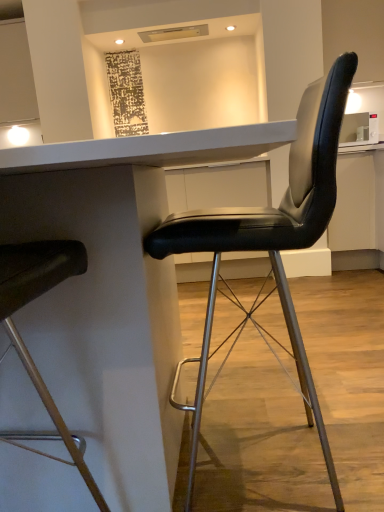
What is the approximate width of matte black chair at left, which appears as the 2th chair when viewed from the right?

16.75 inches.

You are a GUI agent. You are given a task and a screenshot of the screen. Output one action in this format:
    pyautogui.click(x=<x>, y=<y>)
    Task: Click on the white glossy table at center
    
    Given the screenshot: What is the action you would take?
    pyautogui.click(x=114, y=293)

Relative to black leather chair at right, acting as the 2th chair starting from the left, is matte black chair at left, which appears as the 2th chair when viewed from the right, in front or behind?

Visually, matte black chair at left, which appears as the 2th chair when viewed from the right, is located in front of black leather chair at right, acting as the 2th chair starting from the left.

Could you tell me if matte black chair at left, the 1th chair in the left-to-right sequence, is facing black leather chair at right, acting as the 2th chair starting from the left?

No, matte black chair at left, the 1th chair in the left-to-right sequence, is not oriented towards black leather chair at right, acting as the 2th chair starting from the left.

From a real-world perspective, who is located lower, matte black chair at left, the 1th chair in the left-to-right sequence, or black leather chair at right, acting as the 2th chair starting from the left?

black leather chair at right, acting as the 2th chair starting from the left.

Is point (5, 262) farther from viewer compared to point (159, 259)?

No.

Between point (318, 100) and point (24, 364), which one is positioned in front?

Positioned in front is point (24, 364).

Is black leather chair at right, the first chair in the right-to-left sequence, inside the boundaries of matte black chair at left, which appears as the 2th chair when viewed from the right, or outside?

black leather chair at right, the first chair in the right-to-left sequence, is outside matte black chair at left, which appears as the 2th chair when viewed from the right.

Find the location of a particular element. chair on the right of matte black chair at left, the 1th chair in the left-to-right sequence is located at coordinates (274, 234).

Consider the image. Can you tell me how much black leather chair at right, the first chair in the right-to-left sequence, and matte black chair at left, the 1th chair in the left-to-right sequence, differ in facing direction?

90.8 degrees separate the facing orientations of black leather chair at right, the first chair in the right-to-left sequence, and matte black chair at left, the 1th chair in the left-to-right sequence.

Considering the sizes of objects white glossy table at center and matte black chair at left, which appears as the 2th chair when viewed from the right, in the image provided, who is bigger, white glossy table at center or matte black chair at left, which appears as the 2th chair when viewed from the right,?

white glossy table at center is bigger.

Is white glossy table at center in front of matte black chair at left, which appears as the 2th chair when viewed from the right?

No.

Considering the points (17, 293) and (293, 130), which point is behind, point (17, 293) or point (293, 130)?

The point (17, 293) is farther.

Who is taller, matte black chair at left, which appears as the 2th chair when viewed from the right, or white glossy table at center?

matte black chair at left, which appears as the 2th chair when viewed from the right, is taller.

Is matte black chair at left, the 1th chair in the left-to-right sequence, to the left of white glossy table at center from the viewer's perspective?

Indeed, matte black chair at left, the 1th chair in the left-to-right sequence, is positioned on the left side of white glossy table at center.

Consider the image. From a real-world perspective, relative to white glossy table at center, is matte black chair at left, which appears as the 2th chair when viewed from the right, vertically above or below?

matte black chair at left, which appears as the 2th chair when viewed from the right, is above white glossy table at center.

Which is behind, point (159, 257) or point (237, 155)?

The point (237, 155) is farther from the camera.

In the image, is black leather chair at right, acting as the 2th chair starting from the left, on the left side or the right side of white glossy table at center?

black leather chair at right, acting as the 2th chair starting from the left, is positioned on white glossy table at center's right side.

Is white glossy table at center surrounded by black leather chair at right, the first chair in the right-to-left sequence?

No.

Is the position of black leather chair at right, acting as the 2th chair starting from the left, less distant than that of white glossy table at center?

No, it is behind white glossy table at center.

Who is bigger, white glossy table at center or black leather chair at right, the first chair in the right-to-left sequence?

With larger size is white glossy table at center.

Between white glossy table at center and black leather chair at right, the first chair in the right-to-left sequence, which one has less height?

white glossy table at center is shorter.

How much distance is there between white glossy table at center and black leather chair at right, acting as the 2th chair starting from the left?

white glossy table at center is 8.12 inches from black leather chair at right, acting as the 2th chair starting from the left.

Considering the relative positions of white glossy table at center and black leather chair at right, the first chair in the right-to-left sequence, in the image provided, is white glossy table at center in front of black leather chair at right, the first chair in the right-to-left sequence,?

That is True.

The width and height of the screenshot is (384, 512). I want to click on chair behind the matte black chair at left, the 1th chair in the left-to-right sequence, so click(x=274, y=234).

The image size is (384, 512). In order to click on chair below the black leather chair at right, the first chair in the right-to-left sequence (from the image's perspective) in this screenshot , I will do `click(32, 300)`.

Which object lies further to the anchor point matte black chair at left, the 1th chair in the left-to-right sequence, black leather chair at right, the first chair in the right-to-left sequence, or white glossy table at center?

black leather chair at right, the first chair in the right-to-left sequence, is positioned further to the anchor matte black chair at left, the 1th chair in the left-to-right sequence.

Considering their positions, is white glossy table at center positioned closer to matte black chair at left, which appears as the 2th chair when viewed from the right, than black leather chair at right, acting as the 2th chair starting from the left?

white glossy table at center is closer to matte black chair at left, which appears as the 2th chair when viewed from the right.

When comparing their distances from black leather chair at right, acting as the 2th chair starting from the left, does white glossy table at center or matte black chair at left, the 1th chair in the left-to-right sequence, seem further?

Based on the image, matte black chair at left, the 1th chair in the left-to-right sequence, appears to be further to black leather chair at right, acting as the 2th chair starting from the left.

Based on their spatial positions, is black leather chair at right, the first chair in the right-to-left sequence, or matte black chair at left, the 1th chair in the left-to-right sequence, closer to white glossy table at center?

matte black chair at left, the 1th chair in the left-to-right sequence, lies closer to white glossy table at center than the other object.

Based on the photo, considering their positions, is matte black chair at left, the 1th chair in the left-to-right sequence, positioned closer to white glossy table at center than black leather chair at right, the first chair in the right-to-left sequence?

matte black chair at left, the 1th chair in the left-to-right sequence.

Based on their spatial positions, is matte black chair at left, which appears as the 2th chair when viewed from the right, or white glossy table at center closer to black leather chair at right, acting as the 2th chair starting from the left?

white glossy table at center.

Where is `table between matte black chair at left, the 1th chair in the left-to-right sequence, and black leather chair at right, the first chair in the right-to-left sequence, in the horizontal direction`? The height and width of the screenshot is (512, 384). table between matte black chair at left, the 1th chair in the left-to-right sequence, and black leather chair at right, the first chair in the right-to-left sequence, in the horizontal direction is located at coordinates (114, 293).